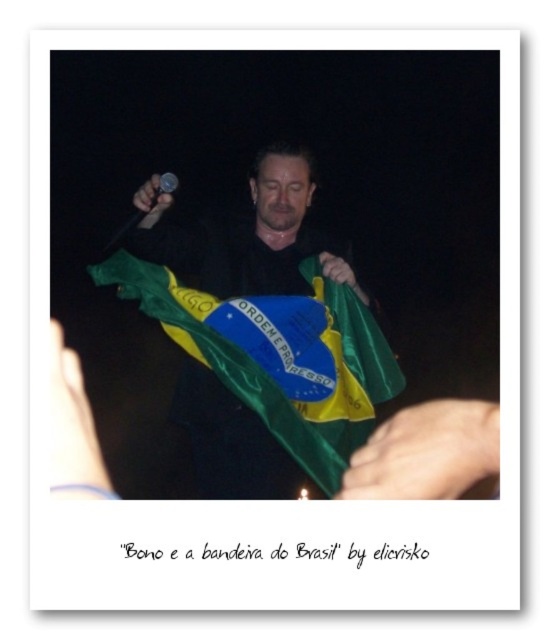
Question: Is white matte skin at lower left thinner than shiny metallic microphone at upper center?

Choices:
 (A) no
 (B) yes

Answer: (B)

Question: Is greenmatte fabricflag at center positioned before matte black microphone at upper center?

Choices:
 (A) yes
 (B) no

Answer: (A)

Question: Among these points, which one is nearest to the camera?

Choices:
 (A) (148, 209)
 (B) (162, 173)
 (C) (58, 477)

Answer: (C)

Question: Which object appears closest to the camera in this image?

Choices:
 (A) matte black microphone at upper center
 (B) white matte skin at lower left
 (C) greenmatte fabricflag at center
 (D) shiny metallic microphone at upper center

Answer: (B)

Question: Which of these objects is positioned farthest from the white matte skin at lower left?

Choices:
 (A) greenmatte fabricflag at center
 (B) matte black microphone at upper center
 (C) green fabric hand at lower right

Answer: (B)

Question: Can you confirm if white matte skin at lower left is thinner than shiny metallic microphone at upper center?

Choices:
 (A) yes
 (B) no

Answer: (A)